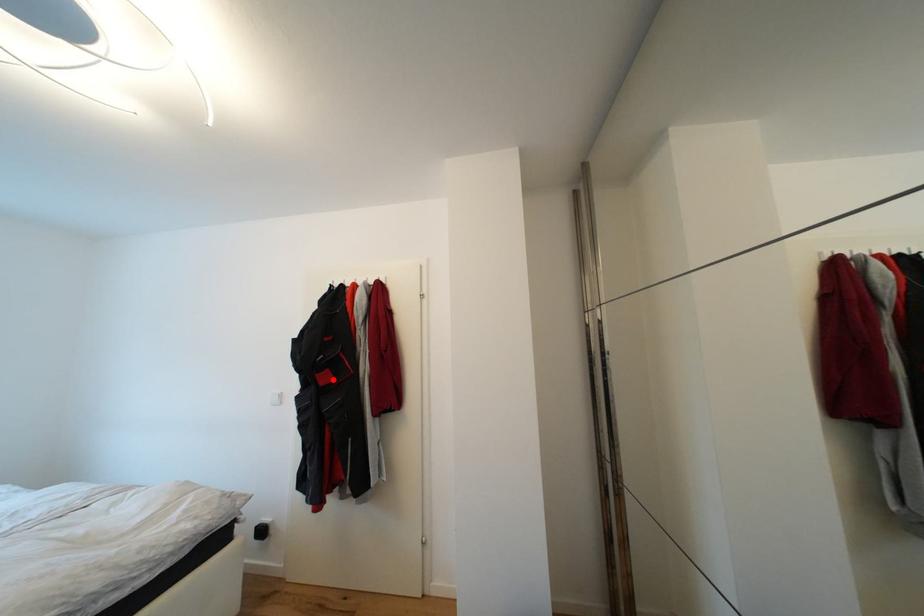
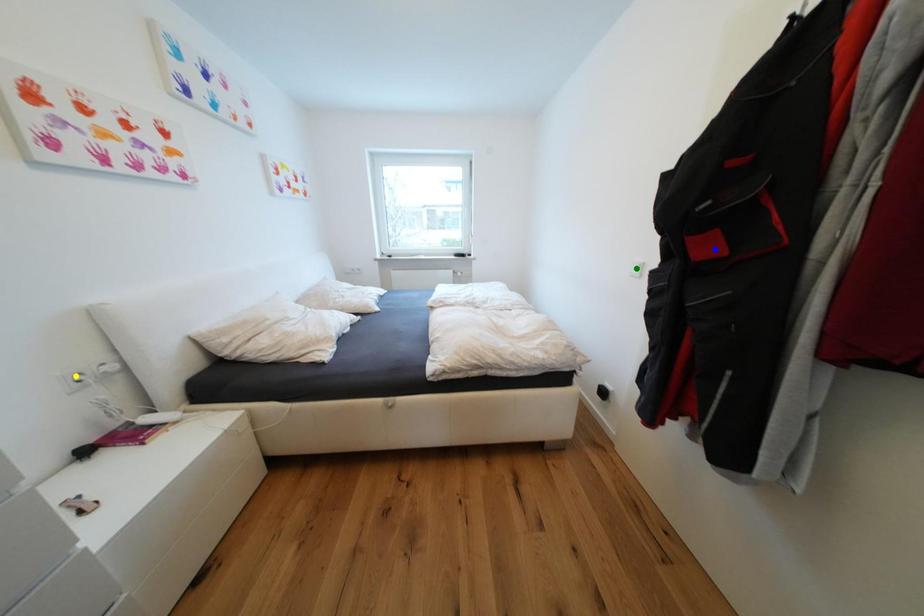
Question: I am providing you with two images of the same scene from different viewpoints. A red point is marked on the first image. You are given multiple points on the second image. Which point in image 2 is actually the same real-world point as the red point in image 1?

Choices:
 (A) blue point
 (B) green point
 (C) yellow point

Answer: (A)